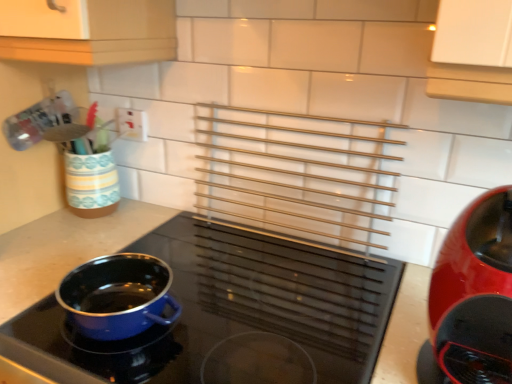
Question: In the image, is white plastic electric outlet at upper left positioned in front of or behind glossy plastic coffee maker at right, which ranks as the second kitchen appliance in left-to-right order?

Choices:
 (A) behind
 (B) front

Answer: (A)

Question: Based on their positions, is white plastic electric outlet at upper left located to the left or right of glossy plastic coffee maker at right, positioned as the 1th kitchen appliance in right-to-left order?

Choices:
 (A) left
 (B) right

Answer: (A)

Question: Which object is the farthest from the blue enamel pot at center-left, which is the 2th kitchen appliance in right-to-left order?

Choices:
 (A) white plastic electric outlet at upper left
 (B) glossy plastic coffee maker at right, which ranks as the second kitchen appliance in left-to-right order

Answer: (A)

Question: Which is farther from the glossy plastic coffee maker at right, which ranks as the second kitchen appliance in left-to-right order?

Choices:
 (A) blue enamel pot at center-left, placed as the first kitchen appliance when sorted from left to right
 (B) white plastic electric outlet at upper left

Answer: (B)